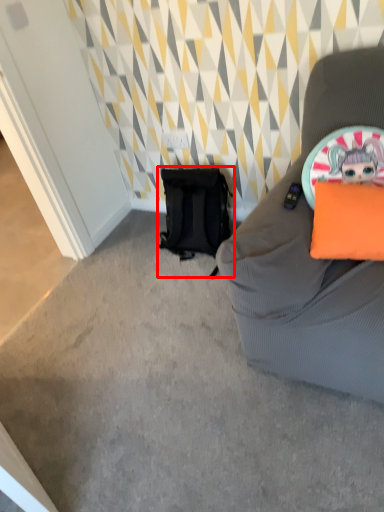
Question: Where is backpack (annotated by the red box) located in relation to pillow in the image?

Choices:
 (A) right
 (B) left

Answer: (B)